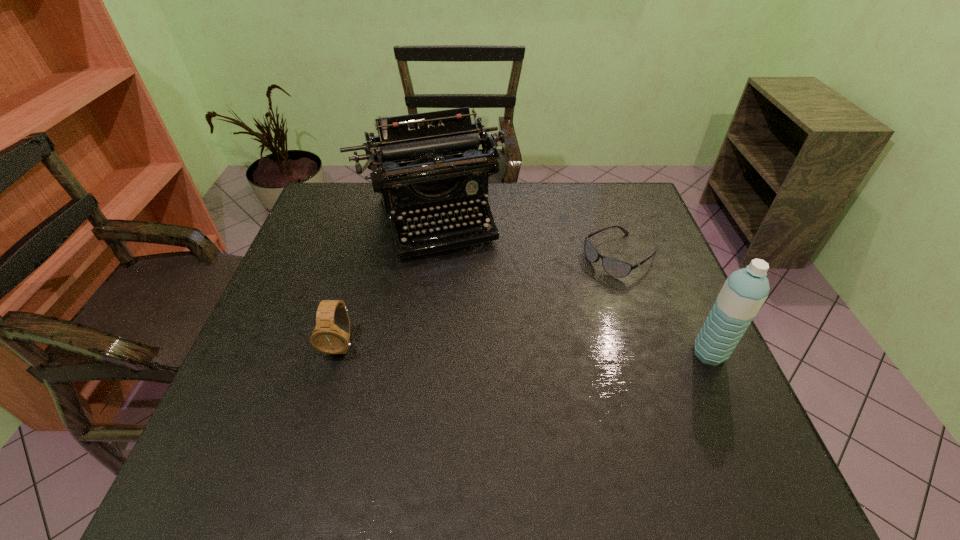
Image resolution: width=960 pixels, height=540 pixels. I want to click on vacant point located between the sunglasses and the typewriter, so click(x=523, y=238).

The width and height of the screenshot is (960, 540). In order to click on free space between the water bottle and the sunglasses in this screenshot , I will do `click(665, 305)`.

Find the location of a particular element. This screenshot has width=960, height=540. vacant space that is in between the watch and the water bottle is located at coordinates (525, 349).

The width and height of the screenshot is (960, 540). I want to click on object identified as the third closest to the second shortest object, so click(x=744, y=292).

Locate an element on the screen. object that stands as the third closest to the sunglasses is located at coordinates (331, 335).

This screenshot has height=540, width=960. I want to click on vacant space that satisfies the following two spatial constraints: 1. on the face of the water bottle; 2. on the left side of the second shortest object, so click(339, 354).

At what (x,y) coordinates should I click in order to perform the action: click on free space in the image that satisfies the following two spatial constraints: 1. on the face of the second shortest object; 2. on the left side of the water bottle. Please return your answer as a coordinate pair (x, y). Looking at the image, I should click on (339, 354).

Where is `vacant space that satisfies the following two spatial constraints: 1. on the face of the water bottle; 2. on the left side of the watch`? vacant space that satisfies the following two spatial constraints: 1. on the face of the water bottle; 2. on the left side of the watch is located at coordinates (339, 354).

The image size is (960, 540). Identify the location of free space in the image that satisfies the following two spatial constraints: 1. on the face of the watch; 2. on the left side of the water bottle. (x=339, y=354).